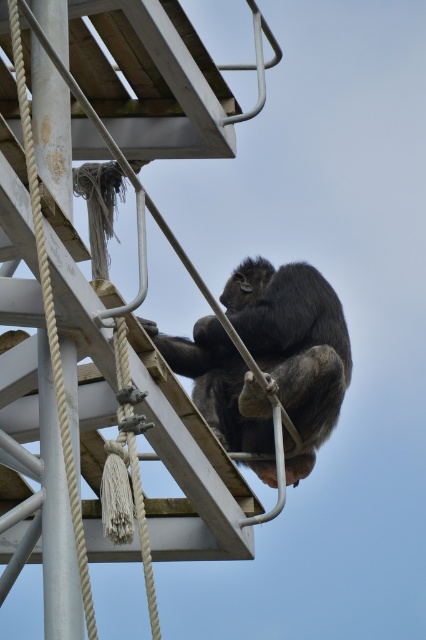
Question: Can you confirm if shiny black monkey at center is positioned to the left of white rope at left?

Choices:
 (A) yes
 (B) no

Answer: (B)

Question: Is shiny black monkey at center below white rope at left?

Choices:
 (A) no
 (B) yes

Answer: (B)

Question: Does shiny black monkey at center have a greater width compared to white rope at left?

Choices:
 (A) yes
 (B) no

Answer: (A)

Question: Which object is farther from the camera taking this photo?

Choices:
 (A) shiny black monkey at center
 (B) white rope at left

Answer: (A)